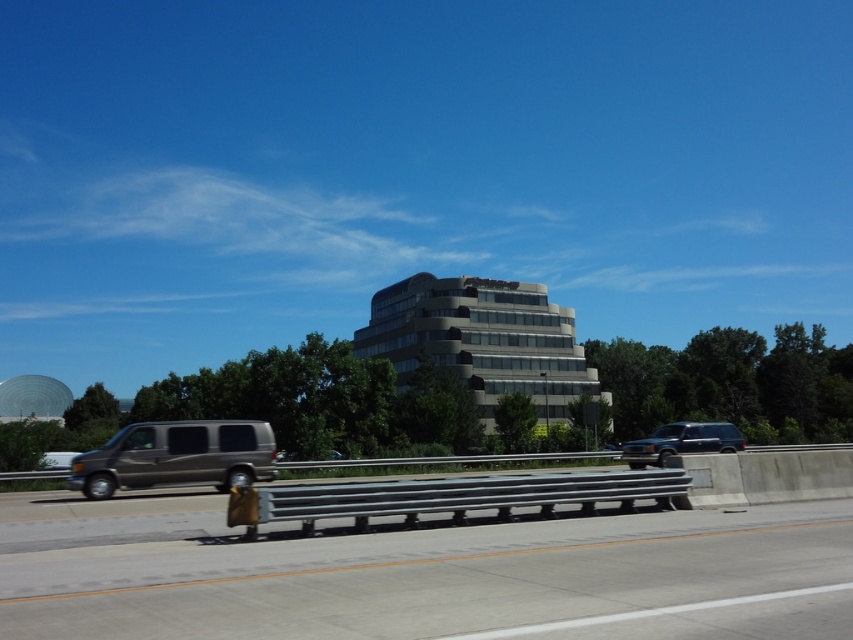
You are a GPS device guiding a driver. The driver is currently at the point represented by point (177, 456) and wants to reach the concrete barrier with metallic guardrail in the foreground. Is the direction towards the concrete barrier with metallic guardrail in the foreground towards the upper or lower part of the image?

The point (177, 456) represents the matte metallic van at lower left. The concrete barrier with metallic guardrail is in the foreground, which is located below the van. Therefore, the direction towards the concrete barrier with metallic guardrail in the foreground is towards the lower part of the image.

Looking at this image, you are a driver approaching the gray concrete barrier at lower center and the matte metallic van at lower left. Based on their positions, which object is closer to you?

The gray concrete barrier at lower center is closer to you because it is positioned above the matte metallic van at lower left, indicating it is nearer in the visual perspective.

You are a driver approaching the gray concrete barrier at lower center and the metallic gray suv at right. Which object is closer to your current position?

The gray concrete barrier at lower center is closer to your current position since it is positioned over the metallic gray suv at right, indicating it is nearer in the visual perspective.